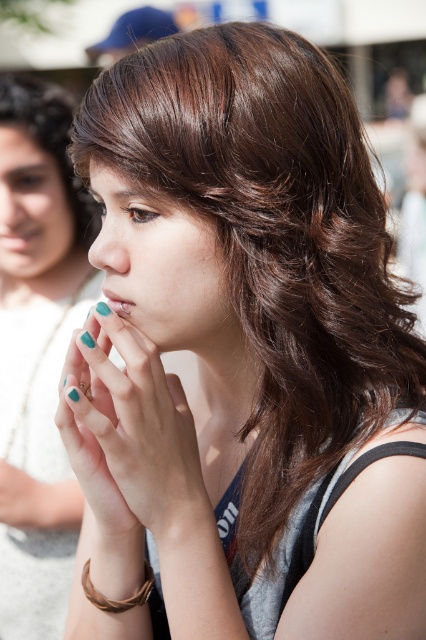
Question: Among these objects, which one is farthest from the camera?

Choices:
 (A) teal matte nails at lower left
 (B) teal nail polish at center
 (C) teal matte nails at left
 (D) teal polished nails at center

Answer: (C)

Question: Considering the real-world distances, which object is closest to the teal nail polish at center?

Choices:
 (A) matte skin at center
 (B) teal matte nails at left

Answer: (A)

Question: Does teal nail polish at center appear over teal matte nails at left?

Choices:
 (A) yes
 (B) no

Answer: (B)

Question: Which point appears closest to the camera in this image?

Choices:
 (A) (5, 92)
 (B) (20, 74)
 (C) (123, 355)

Answer: (C)

Question: Is matte skin at center to the left of brown woven bracelet at lower left from the viewer's perspective?

Choices:
 (A) yes
 (B) no

Answer: (A)

Question: Considering the relative positions of teal matte nails at left and matte skin at center in the image provided, where is teal matte nails at left located with respect to matte skin at center?

Choices:
 (A) right
 (B) left

Answer: (A)